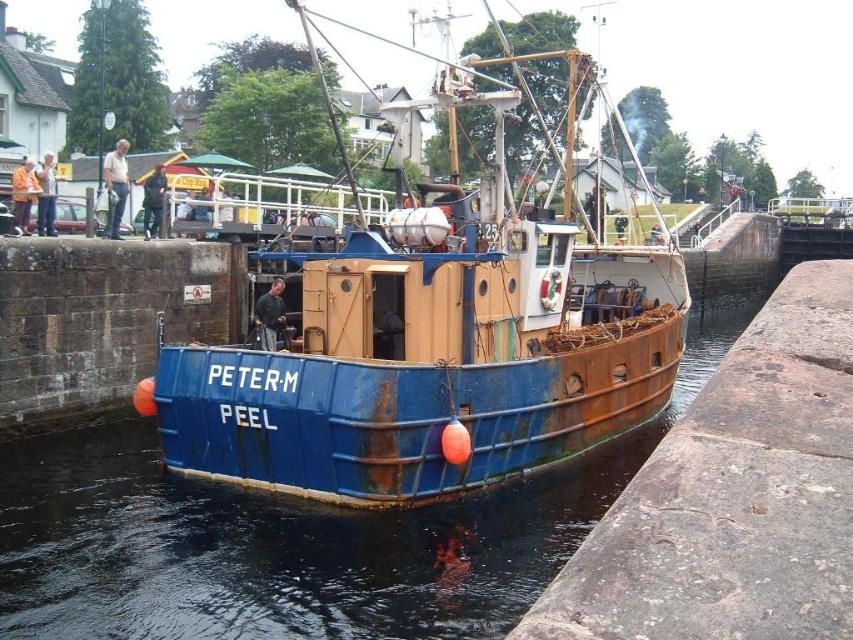
You are a sailor who needs to board the rusty metal boat at center. Given that the water level is at the rusty metal water at center, will you be able to step onto the boat from the dock without using a ladder?

The rusty metal boat at center is much taller than the rusty metal water at center, so you will need a ladder or some assistance to board the boat since the height difference is significant.

You are standing on the dock observing the rusty metal boat at center and the rusty metal water at center. Which object is positioned more to the left?

The rusty metal boat at center is positioned more to the left than the rusty metal water at center.